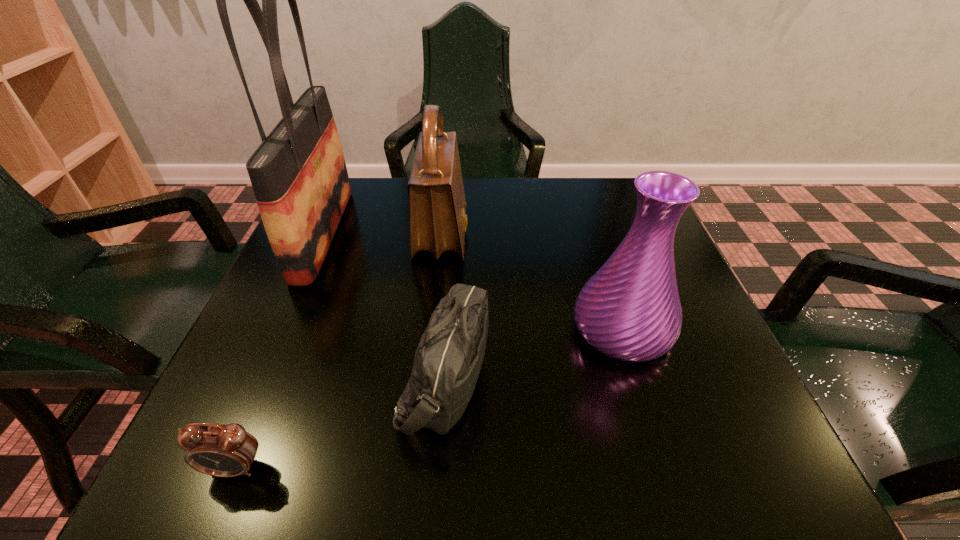
Where is `free space at the far edge`? The image size is (960, 540). free space at the far edge is located at coordinates (520, 213).

Image resolution: width=960 pixels, height=540 pixels. In the image, there is a desktop. Identify the location of vacant space at the near edge. (490, 482).

Image resolution: width=960 pixels, height=540 pixels. In the image, there is a desktop. Find the location of `vacant space at the left edge`. vacant space at the left edge is located at coordinates pyautogui.click(x=328, y=334).

Where is `free space at the far left corner of the desktop`? This screenshot has width=960, height=540. free space at the far left corner of the desktop is located at coordinates (350, 185).

This screenshot has height=540, width=960. In the image, there is a desktop. In order to click on vacant space at the far right corner in this screenshot , I will do `click(619, 204)`.

This screenshot has width=960, height=540. In order to click on free space at the near right corner of the desktop in this screenshot , I will do `click(686, 451)`.

This screenshot has height=540, width=960. Identify the location of unoccupied position between the nearest object and the nearer shoulder bag. (340, 423).

This screenshot has width=960, height=540. In order to click on empty space that is in between the fourth tallest object and the tallest object in this screenshot , I will do `click(384, 306)`.

You are a GUI agent. You are given a task and a screenshot of the screen. Output one action in this format:
    pyautogui.click(x=<x>, y=<y>)
    Task: Click on the free space between the shopping bag and the rightmost object
    
    Given the screenshot: What is the action you would take?
    pyautogui.click(x=472, y=281)

Locate an element on the screen. This screenshot has width=960, height=540. blank region between the shorter shoulder bag and the rightmost object is located at coordinates (534, 354).